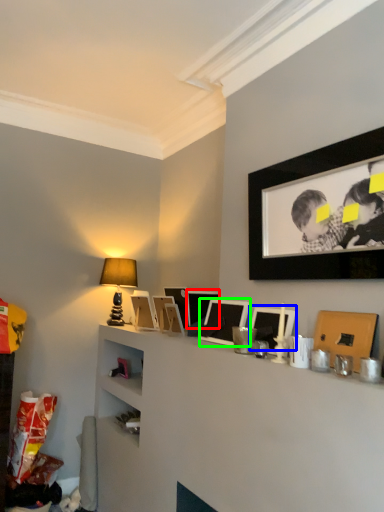
Question: Estimate the real-world distances between objects in this image. Which object is farther from picture frame (highlighted by a red box), picture frame (highlighted by a blue box) or picture frame (highlighted by a green box)?

Choices:
 (A) picture frame
 (B) picture frame

Answer: (A)